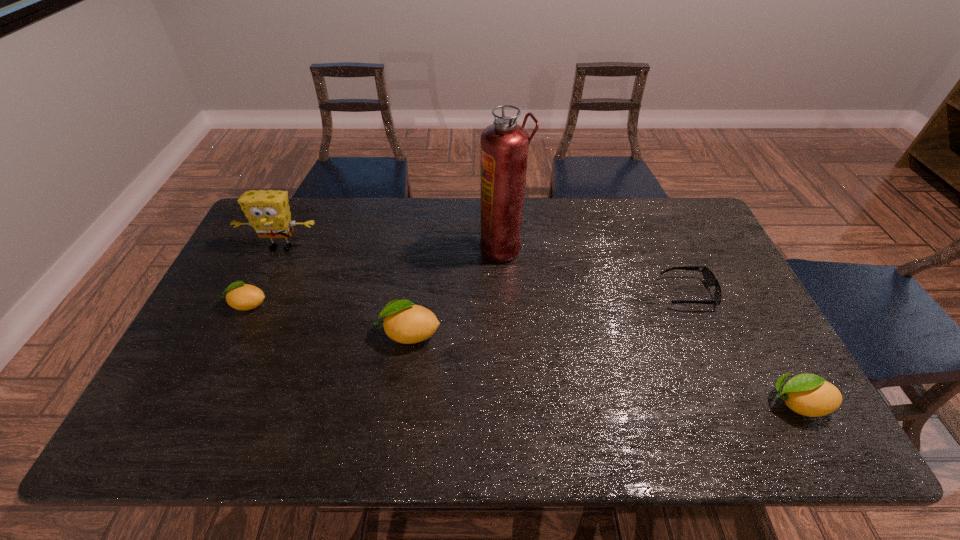
Locate an element on the screen. The width and height of the screenshot is (960, 540). object that is at the far left corner is located at coordinates (268, 212).

Image resolution: width=960 pixels, height=540 pixels. I want to click on object present at the near right corner, so click(807, 394).

At what (x,y) coordinates should I click in order to perform the action: click on vacant space at the far edge of the desktop. Please return your answer as a coordinate pair (x, y). The width and height of the screenshot is (960, 540). Looking at the image, I should click on [563, 234].

Locate an element on the screen. This screenshot has height=540, width=960. free region at the near edge of the desktop is located at coordinates (650, 381).

Image resolution: width=960 pixels, height=540 pixels. In the image, there is a desktop. Identify the location of free region at the left edge. (228, 278).

Identify the location of vacant region at the right edge of the desktop. The image size is (960, 540). (735, 329).

Where is `free region at the near left corner of the desktop`? Image resolution: width=960 pixels, height=540 pixels. free region at the near left corner of the desktop is located at coordinates (176, 399).

Where is `unoccupied position between the fifth shortest object and the nearest object`? This screenshot has width=960, height=540. unoccupied position between the fifth shortest object and the nearest object is located at coordinates (540, 325).

This screenshot has width=960, height=540. Identify the location of empty space that is in between the nearest lemon and the sunglasses. (742, 348).

Locate an element on the screen. This screenshot has height=540, width=960. unoccupied position between the fifth shortest object and the nearest object is located at coordinates (540, 325).